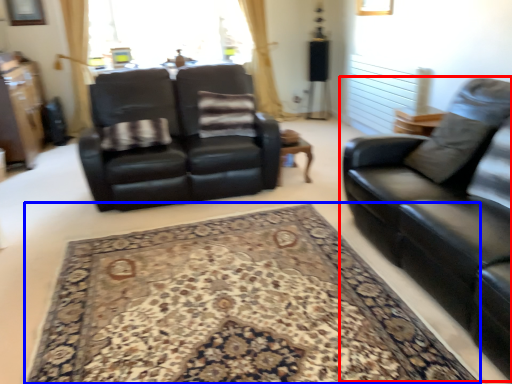
Question: Which object is closer to the camera taking this photo, studio couch (highlighted by a red box) or mat (highlighted by a blue box)?

Choices:
 (A) studio couch
 (B) mat

Answer: (A)